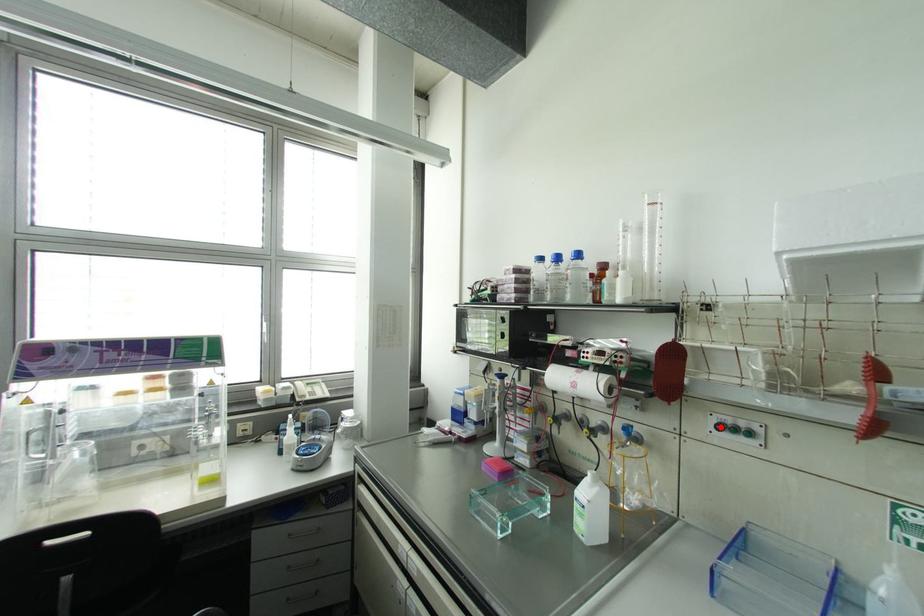
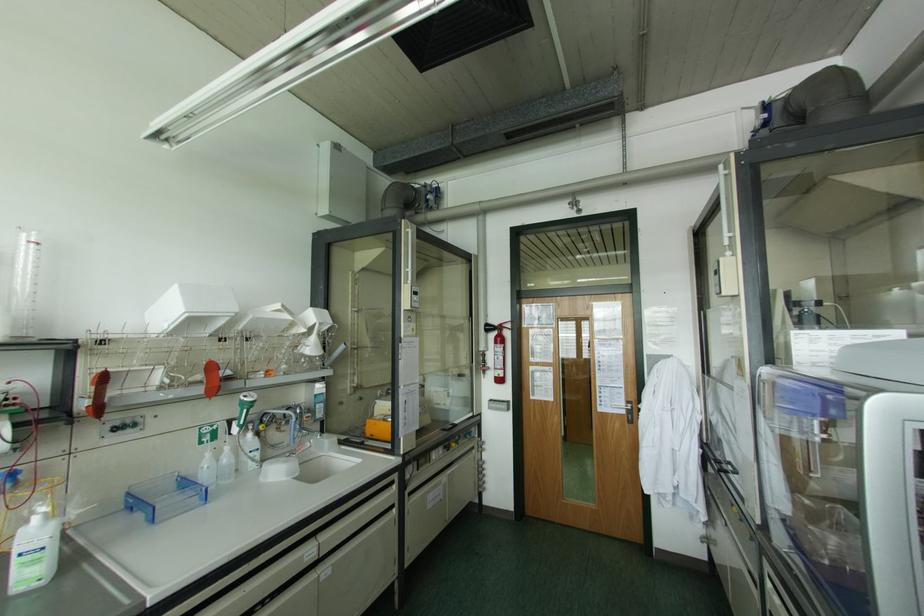
In the second image, find the point that corresponds to the highlighted location in the first image.

(115, 428)